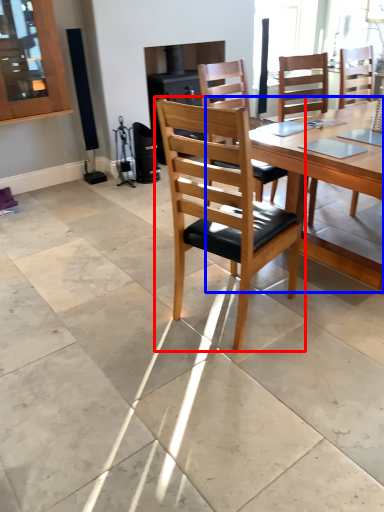
Question: Which of the following is the farthest to the observer, chair (highlighted by a red box) or round table (highlighted by a blue box)?

Choices:
 (A) chair
 (B) round table

Answer: (B)